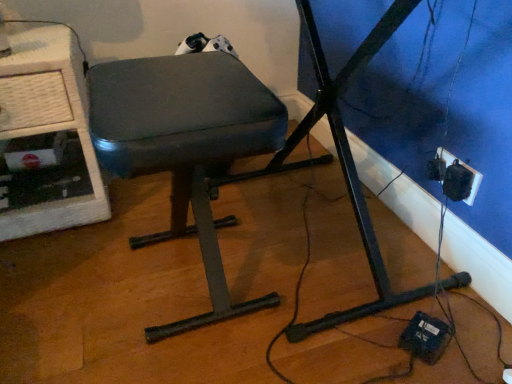
The width and height of the screenshot is (512, 384). What are the coordinates of `vacant area located to the right-hand side of white textured computer desk at left` in the screenshot? It's located at (139, 200).